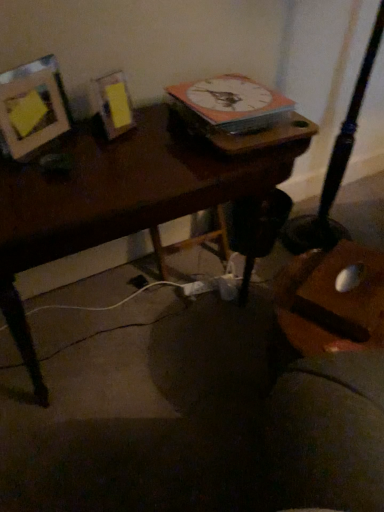
This screenshot has height=512, width=384. In order to click on vacant space situated above wooden desk at center (from a real-world perspective) in this screenshot , I will do `click(107, 153)`.